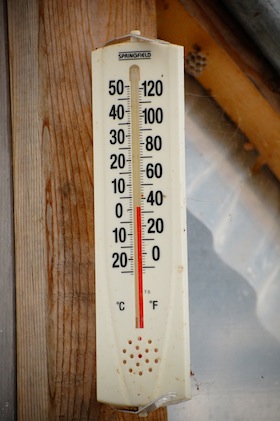
Locate an element on the screen. cheap plastic thermometer is located at coordinates (161, 72).